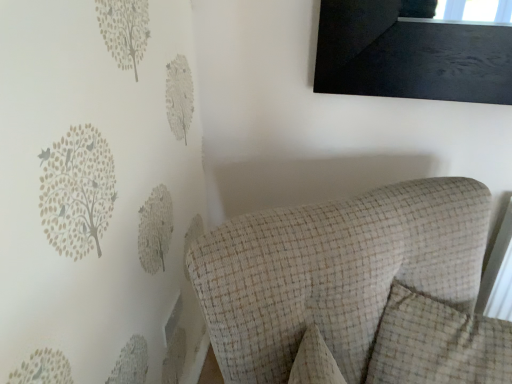
In order to face textured beige armchair at center, should I rotate leftwards or rightwards?

To align with it, rotate right about 15.667°.

I want to click on textured beige armchair at center, so click(355, 290).

What do you see at coordinates (355, 290) in the screenshot?
I see `textured beige armchair at center` at bounding box center [355, 290].

Identify the location of beige checkered pillow at center. This screenshot has height=384, width=512. (438, 344).

This screenshot has width=512, height=384. Describe the element at coordinates (438, 344) in the screenshot. I see `beige checkered pillow at center` at that location.

What is the approximate height of beige checkered pillow at center?

beige checkered pillow at center is 12.25 inches in height.

Locate an element on the screen. textured beige armchair at center is located at coordinates [x=355, y=290].

In the scene shown: Does textured beige armchair at center appear on the left side of beige checkered pillow at center?

Yes.

Consider the image. Is textured beige armchair at center in front of or behind beige checkered pillow at center in the image?

Visually, textured beige armchair at center is located in front of beige checkered pillow at center.

Considering the points (262, 383) and (392, 333), which point is in front, point (262, 383) or point (392, 333)?

Point (262, 383)

From the image's perspective, between textured beige armchair at center and beige checkered pillow at center, which one is located above?

beige checkered pillow at center.

From a real-world perspective, is textured beige armchair at center positioned under beige checkered pillow at center based on gravity?

Yes, from a real-world perspective, textured beige armchair at center is under beige checkered pillow at center.

In terms of width, does textured beige armchair at center look wider or thinner when compared to beige checkered pillow at center?

Clearly, textured beige armchair at center has more width compared to beige checkered pillow at center.

Considering the sizes of textured beige armchair at center and beige checkered pillow at center in the image, is textured beige armchair at center taller or shorter than beige checkered pillow at center?

Clearly, textured beige armchair at center is taller compared to beige checkered pillow at center.

Can you confirm if textured beige armchair at center is bigger than beige checkered pillow at center?

Indeed, textured beige armchair at center has a larger size compared to beige checkered pillow at center.

Is textured beige armchair at center surrounding beige checkered pillow at center?

Yes, beige checkered pillow at center is surrounded by textured beige armchair at center.

Is textured beige armchair at center beside beige checkered pillow at center?

No, textured beige armchair at center is not touching beige checkered pillow at center.

Is textured beige armchair at center looking in the opposite direction of beige checkered pillow at center?

Yes.

What's the angular difference between textured beige armchair at center and beige checkered pillow at center's facing directions?

They differ by 38.4 degrees in their facing directions.

At what (x,y) coordinates should I click in order to perform the action: click on furniture lying below the beige checkered pillow at center (from the image's perspective). Please return your answer as a coordinate pair (x, y). The width and height of the screenshot is (512, 384). Looking at the image, I should click on (355, 290).

Considering the positions of objects beige checkered pillow at center and textured beige armchair at center in the image provided, who is more to the right, beige checkered pillow at center or textured beige armchair at center?

beige checkered pillow at center.

Does beige checkered pillow at center come behind textured beige armchair at center?

Yes.

Which is less distant, (406, 316) or (266, 214)?

Point (406, 316).

From the image's perspective, who appears lower, beige checkered pillow at center or textured beige armchair at center?

From the image's view, textured beige armchair at center is below.

Looking at this image, from a real-world perspective, is beige checkered pillow at center positioned under textured beige armchair at center based on gravity?

Incorrect, from a real-world perspective, beige checkered pillow at center is higher than textured beige armchair at center.

In terms of width, does beige checkered pillow at center look wider or thinner when compared to textured beige armchair at center?

beige checkered pillow at center is thinner than textured beige armchair at center.

Who is taller, beige checkered pillow at center or textured beige armchair at center?

textured beige armchair at center is taller.

Does beige checkered pillow at center have a larger size compared to textured beige armchair at center?

No.

Do you think beige checkered pillow at center is within textured beige armchair at center, or outside of it?

beige checkered pillow at center is inside textured beige armchair at center.

Consider the image. Is beige checkered pillow at center not near textured beige armchair at center?

That's not correct — beige checkered pillow at center is a little close to textured beige armchair at center.

Is beige checkered pillow at center looking in the opposite direction of textured beige armchair at center?

Yes, textured beige armchair at center is at the back of beige checkered pillow at center.

I want to click on furniture below the beige checkered pillow at center (from a real-world perspective), so click(x=355, y=290).

Where is `furniture that appears in front of the beige checkered pillow at center`? furniture that appears in front of the beige checkered pillow at center is located at coordinates (355, 290).

This screenshot has height=384, width=512. What are the coordinates of `furniture lying on the left of beige checkered pillow at center` in the screenshot? It's located at (355, 290).